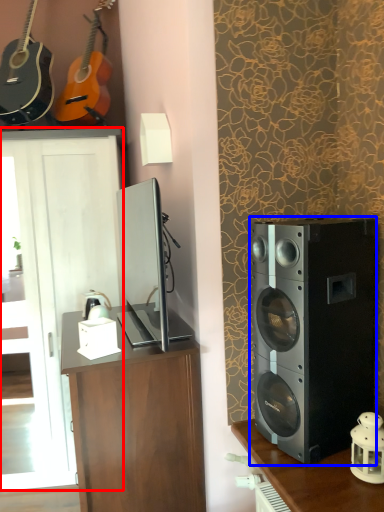
Question: Which object appears farthest to the camera in this image, cabinetry (highlighted by a red box) or loudspeaker (highlighted by a blue box)?

Choices:
 (A) cabinetry
 (B) loudspeaker

Answer: (A)